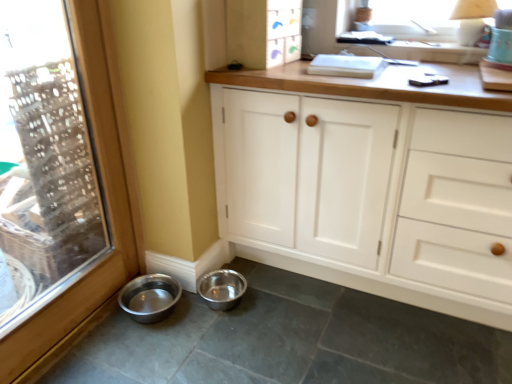
Question: Is metallic silver bowl at lower left, which is counted as the first basin, starting from the left, a part of white wood cabinet at upper center, positioned as the second cabinetry in bottom-to-top order?

Choices:
 (A) yes
 (B) no

Answer: (B)

Question: Could you tell me if white wood cabinet at upper center, positioned as the second cabinetry in bottom-to-top order, is turned towards metallic silver bowl at lower left, which is counted as the first basin, starting from the left?

Choices:
 (A) no
 (B) yes

Answer: (A)

Question: From a real-world perspective, is white wood cabinet at upper center, which ranks as the 1th cabinetry in top-to-bottom order, over metallic silver bowl at lower left, the 2th basin viewed from the right?

Choices:
 (A) yes
 (B) no

Answer: (A)

Question: Would you say white wood cabinet at upper center, which ranks as the 1th cabinetry in top-to-bottom order, is a long distance from metallic silver bowl at lower left, which is counted as the first basin, starting from the left?

Choices:
 (A) yes
 (B) no

Answer: (A)

Question: Is white wood cabinet at upper center, which ranks as the 1th cabinetry in top-to-bottom order, to the left of metallic silver bowl at lower left, which is counted as the first basin, starting from the left, from the viewer's perspective?

Choices:
 (A) yes
 (B) no

Answer: (B)

Question: Considering the positions of point (97, 264) and point (239, 244), is point (97, 264) closer or farther from the camera than point (239, 244)?

Choices:
 (A) farther
 (B) closer

Answer: (B)

Question: From the image's perspective, relative to white wood cabinet at center, the 1th cabinetry from the bottom, is transparent glass window at left above or below?

Choices:
 (A) above
 (B) below

Answer: (B)

Question: From a real-world perspective, is transparent glass window at left physically located above or below white wood cabinet at center, the 1th cabinetry from the bottom?

Choices:
 (A) below
 (B) above

Answer: (B)

Question: Do you think transparent glass window at left is within white wood cabinet at center, the second cabinetry from the top, or outside of it?

Choices:
 (A) outside
 (B) inside

Answer: (A)

Question: Does point (448, 324) appear closer or farther from the camera than point (160, 274)?

Choices:
 (A) farther
 (B) closer

Answer: (B)

Question: From the image's perspective, is metal bowls at lower left positioned above or below metallic silver bowl at lower left, the 2th basin viewed from the right?

Choices:
 (A) below
 (B) above

Answer: (A)

Question: Which is correct: metal bowls at lower left is inside metallic silver bowl at lower left, the 2th basin viewed from the right, or outside of it?

Choices:
 (A) inside
 (B) outside

Answer: (B)

Question: Considering the positions of metal bowls at lower left and metallic silver bowl at lower left, the 2th basin viewed from the right, in the image, is metal bowls at lower left wider or thinner than metallic silver bowl at lower left, the 2th basin viewed from the right,?

Choices:
 (A) wide
 (B) thin

Answer: (A)

Question: Considering the positions of transparent glass window at left and metal bowls at lower left in the image, is transparent glass window at left wider or thinner than metal bowls at lower left?

Choices:
 (A) wide
 (B) thin

Answer: (B)

Question: Is point (115, 137) closer or farther from the camera than point (300, 334)?

Choices:
 (A) closer
 (B) farther

Answer: (A)